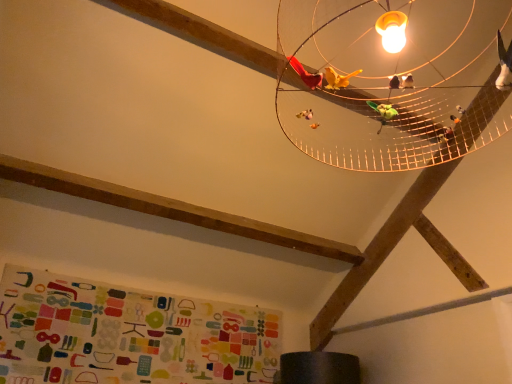
In the scene shown: Measure the distance between point (424, 50) and camera.

A distance of 2.18 meters exists between point (424, 50) and camera.

This screenshot has height=384, width=512. What do you see at coordinates (394, 79) in the screenshot?
I see `metallic wire mesh at upper center` at bounding box center [394, 79].

In order to click on metallic wire mesh at upper center in this screenshot , I will do `click(394, 79)`.

This screenshot has width=512, height=384. Describe the element at coordinates (128, 335) in the screenshot. I see `multicolored fabric bulletin board at lower left` at that location.

Locate an element on the screen. multicolored fabric bulletin board at lower left is located at coordinates (128, 335).

The image size is (512, 384). In order to click on metallic wire mesh at upper center in this screenshot , I will do `click(394, 79)`.

Is metallic wire mesh at upper center to the left of multicolored fabric bulletin board at lower left from the viewer's perspective?

No, metallic wire mesh at upper center is not to the left of multicolored fabric bulletin board at lower left.

Considering the positions of objects metallic wire mesh at upper center and multicolored fabric bulletin board at lower left in the image provided, who is in front, metallic wire mesh at upper center or multicolored fabric bulletin board at lower left?

metallic wire mesh at upper center is more forward.

Does point (323, 113) come in front of point (209, 361)?

Yes, point (323, 113) is closer to viewer.

From the image's perspective, which is below, metallic wire mesh at upper center or multicolored fabric bulletin board at lower left?

multicolored fabric bulletin board at lower left, from the image's perspective.

From a real-world perspective, is metallic wire mesh at upper center located higher than multicolored fabric bulletin board at lower left?

Yes, from a real-world perspective, metallic wire mesh at upper center is above multicolored fabric bulletin board at lower left.

Which of these two, metallic wire mesh at upper center or multicolored fabric bulletin board at lower left, is wider?

With larger width is metallic wire mesh at upper center.

Considering the sizes of metallic wire mesh at upper center and multicolored fabric bulletin board at lower left in the image, is metallic wire mesh at upper center taller or shorter than multicolored fabric bulletin board at lower left?

metallic wire mesh at upper center is taller than multicolored fabric bulletin board at lower left.

Who is bigger, metallic wire mesh at upper center or multicolored fabric bulletin board at lower left?

Bigger between the two is metallic wire mesh at upper center.

Choose the correct answer: Is metallic wire mesh at upper center inside multicolored fabric bulletin board at lower left or outside it?

metallic wire mesh at upper center exists outside the volume of multicolored fabric bulletin board at lower left.

Is metallic wire mesh at upper center next to multicolored fabric bulletin board at lower left and touching it?

They are not placed beside each other.

Based on the photo, is metallic wire mesh at upper center oriented towards multicolored fabric bulletin board at lower left?

No, metallic wire mesh at upper center does not turn towards multicolored fabric bulletin board at lower left.

Could you measure the distance between metallic wire mesh at upper center and multicolored fabric bulletin board at lower left?

6.30 feet.

Find the location of `bulletin board below the metallic wire mesh at upper center (from the image's perspective)`. bulletin board below the metallic wire mesh at upper center (from the image's perspective) is located at coordinates (128, 335).

Considering the relative positions of multicolored fabric bulletin board at lower left and metallic wire mesh at upper center in the image provided, is multicolored fabric bulletin board at lower left to the right of metallic wire mesh at upper center from the viewer's perspective?

No, multicolored fabric bulletin board at lower left is not to the right of metallic wire mesh at upper center.

Which object is more forward, multicolored fabric bulletin board at lower left or metallic wire mesh at upper center?

metallic wire mesh at upper center is in front.

Considering the positions of points (61, 297) and (500, 77), is point (61, 297) closer to camera compared to point (500, 77)?

No, it is not.

From the image's perspective, which object appears higher, multicolored fabric bulletin board at lower left or metallic wire mesh at upper center?

metallic wire mesh at upper center.

From a real-world perspective, relative to metallic wire mesh at upper center, is multicolored fabric bulletin board at lower left vertically above or below?

In terms of real-world spatial position, multicolored fabric bulletin board at lower left is below metallic wire mesh at upper center.

Between multicolored fabric bulletin board at lower left and metallic wire mesh at upper center, which one has smaller width?

multicolored fabric bulletin board at lower left is thinner.

Which of these two, multicolored fabric bulletin board at lower left or metallic wire mesh at upper center, stands taller?

metallic wire mesh at upper center.

Looking at this image, who is smaller, multicolored fabric bulletin board at lower left or metallic wire mesh at upper center?

multicolored fabric bulletin board at lower left.

Is multicolored fabric bulletin board at lower left positioned beyond the bounds of metallic wire mesh at upper center?

Yes, multicolored fabric bulletin board at lower left is not within metallic wire mesh at upper center.

Is multicolored fabric bulletin board at lower left touching metallic wire mesh at upper center?

multicolored fabric bulletin board at lower left and metallic wire mesh at upper center are not in contact.

Is metallic wire mesh at upper center at the back of multicolored fabric bulletin board at lower left?

No, metallic wire mesh at upper center is not at the back of multicolored fabric bulletin board at lower left.

How distant is multicolored fabric bulletin board at lower left from metallic wire mesh at upper center?

6.30 feet.

The image size is (512, 384). What are the coordinates of `bulletin board that appears below the metallic wire mesh at upper center (from a real-world perspective)` in the screenshot? It's located at (128, 335).

In the image, there is a multicolored fabric bulletin board at lower left. Where is `lamp above it (from the image's perspective)`? lamp above it (from the image's perspective) is located at coordinates (394, 79).

The height and width of the screenshot is (384, 512). I want to click on bulletin board below the metallic wire mesh at upper center (from a real-world perspective), so click(128, 335).